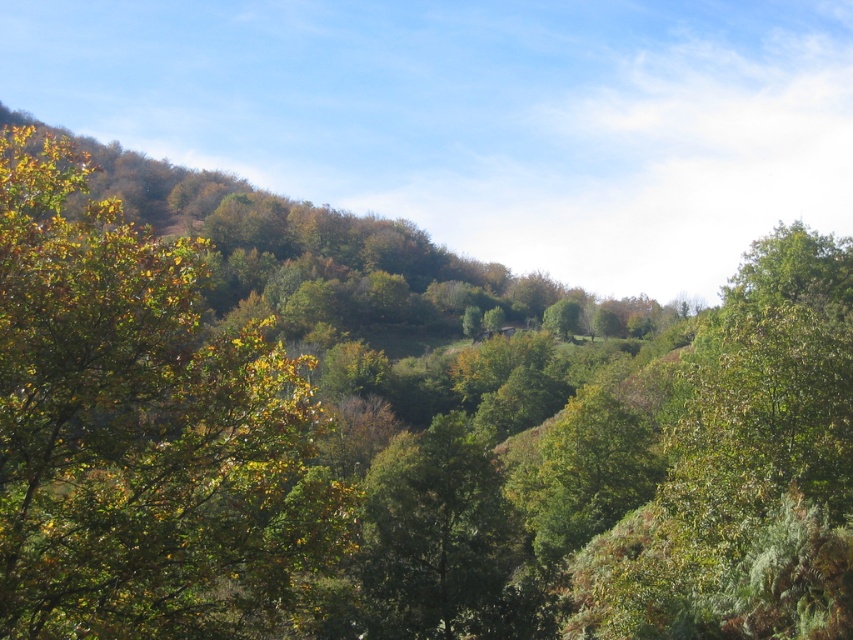
You are standing in the middle of a forest and see a green leafy tree at left and a green leafy tree at center. Which tree is nearer to you?

The green leafy tree at left is closer to the viewer than the green leafy tree at center, so the green leafy tree at left is nearer to you.

You are an environmental scientist studying tree distribution in this forest area. You observe the green leafy tree at left and the green leafy tree at center. Which tree is positioned higher in the image?

The green leafy tree at left is positioned higher in the image than the green leafy tree at center.